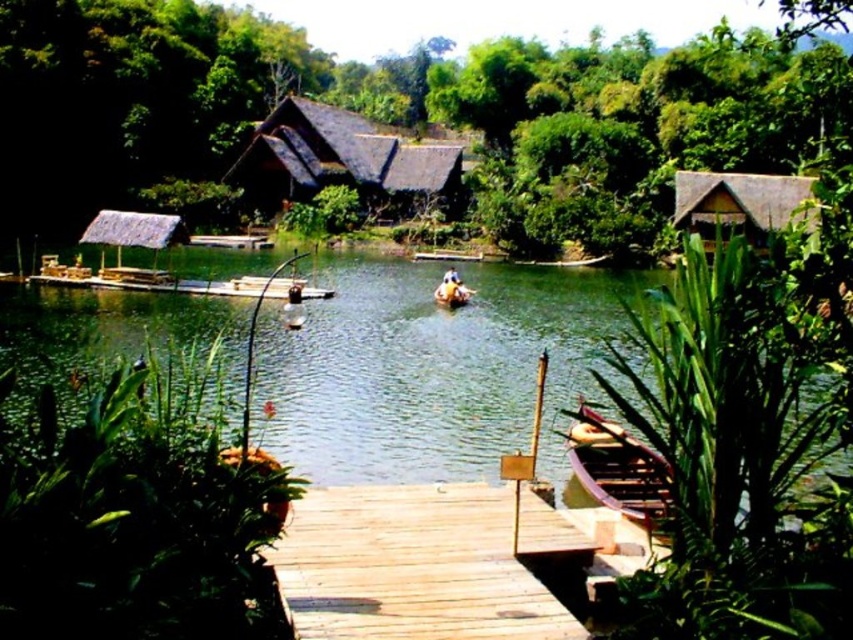
Who is positioned more to the right, green leafy plant at lower right or thatched straw hut at left?

green leafy plant at lower right is more to the right.

Between point (833, 499) and point (115, 241), which one is positioned in front?

Point (833, 499) is in front.

Where is `green leafy plant at lower right`? This screenshot has height=640, width=853. green leafy plant at lower right is located at coordinates (746, 442).

Between wooden dock at center and brown wooden canoe at center, which one appears on the left side from the viewer's perspective?

wooden dock at center is more to the left.

Which is in front, point (538, 630) or point (461, 285)?

Point (538, 630) is in front.

What do you see at coordinates (410, 566) in the screenshot? This screenshot has height=640, width=853. I see `wooden dock at center` at bounding box center [410, 566].

Find the location of a particular element. wooden dock at center is located at coordinates (410, 566).

What do you see at coordinates (740, 205) in the screenshot?
I see `thatched wood hut at upper right` at bounding box center [740, 205].

Is point (755, 237) less distant than point (608, 426)?

No.

This screenshot has width=853, height=640. Identify the location of thatched wood hut at upper right. (740, 205).

Where is `thatched wood hut at upper right`? thatched wood hut at upper right is located at coordinates (740, 205).